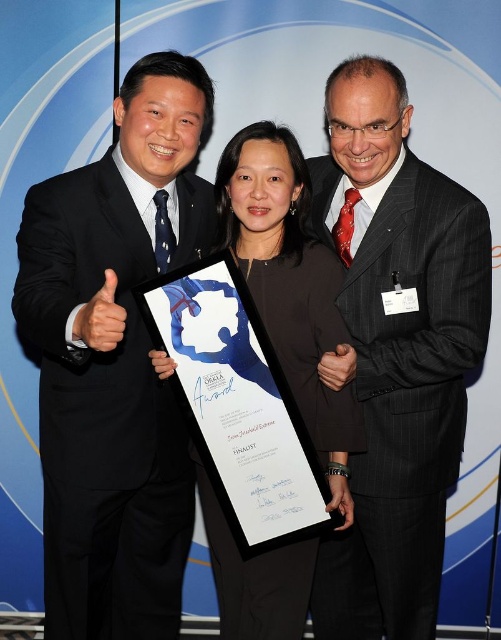
Question: Considering the relative positions of matte black suit at left and black fabric dress at center in the image provided, where is matte black suit at left located with respect to black fabric dress at center?

Choices:
 (A) left
 (B) right

Answer: (A)

Question: Among these points, which one is nearest to the camera?

Choices:
 (A) (453, 460)
 (B) (67, 490)
 (C) (240, 636)

Answer: (B)

Question: Which is nearer to the black fabric dress at center?

Choices:
 (A) black pinstripe suit at center
 (B) matte black suit at left

Answer: (A)

Question: Which of the following is the farthest from the observer?

Choices:
 (A) (297, 241)
 (B) (114, 372)
 (C) (438, 326)

Answer: (A)

Question: Does matte black suit at left appear over black pinstripe suit at center?

Choices:
 (A) no
 (B) yes

Answer: (A)

Question: Does matte black suit at left appear over black pinstripe suit at center?

Choices:
 (A) yes
 (B) no

Answer: (B)